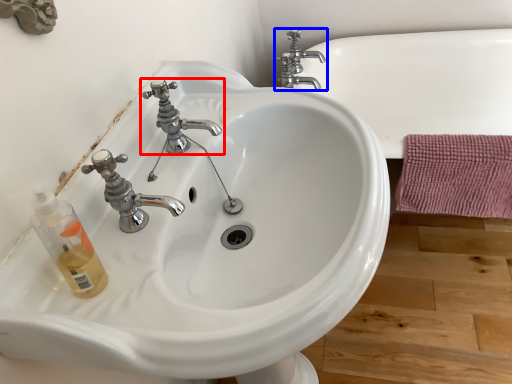
Question: Which object is further to the camera taking this photo, tap (highlighted by a red box) or tap (highlighted by a blue box)?

Choices:
 (A) tap
 (B) tap

Answer: (B)